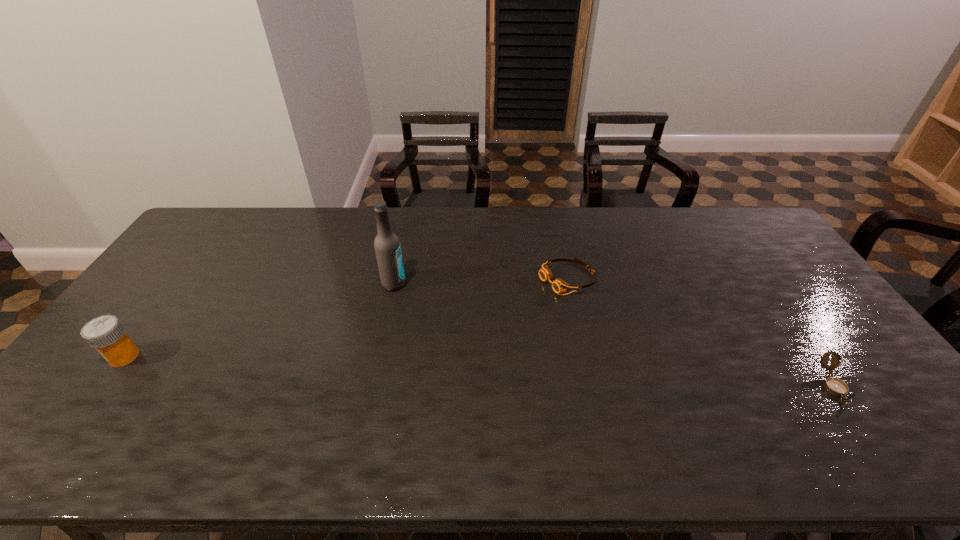
Where is `free spot located 0.280m with the lenses facing forward on the third object from left to right`? Image resolution: width=960 pixels, height=540 pixels. free spot located 0.280m with the lenses facing forward on the third object from left to right is located at coordinates (468, 325).

This screenshot has width=960, height=540. Identify the location of vacant space located on the label of the tallest object. (434, 307).

I want to click on free point located on the label of the tallest object, so click(466, 325).

Where is `free region located on the label of the tallest object`? free region located on the label of the tallest object is located at coordinates (476, 332).

Locate an element on the screen. The image size is (960, 540). object present at the near edge is located at coordinates (835, 386).

Where is `object present at the left edge`? This screenshot has width=960, height=540. object present at the left edge is located at coordinates (106, 334).

This screenshot has width=960, height=540. Identify the location of object that is at the right edge. (835, 386).

This screenshot has width=960, height=540. Find the location of `object at the near right corner`. object at the near right corner is located at coordinates (835, 386).

Identify the location of vacant space at the far edge of the desktop. Image resolution: width=960 pixels, height=540 pixels. (329, 224).

Where is `vacant region at the near edge of the desktop`? vacant region at the near edge of the desktop is located at coordinates (203, 388).